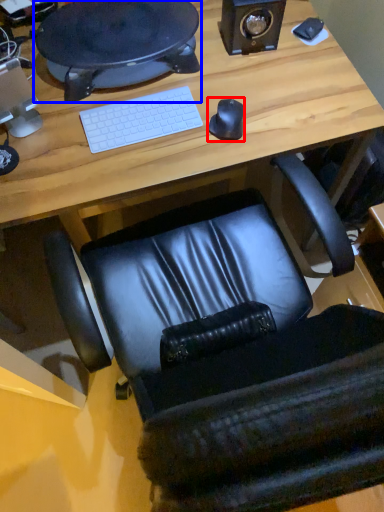
Question: Which of the following is the farthest to the observer, mouse (highlighted by a red box) or desktop (highlighted by a blue box)?

Choices:
 (A) mouse
 (B) desktop

Answer: (B)